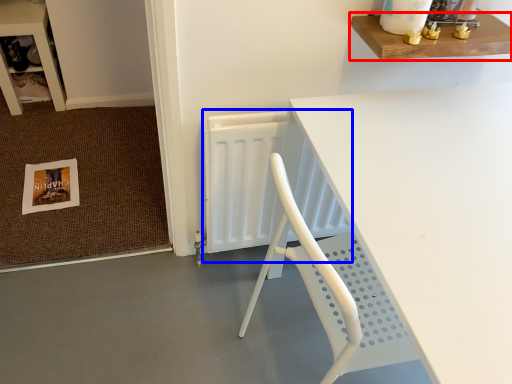
Question: Which point is closer to the camera, shelf (highlighted by a red box) or radiator (highlighted by a blue box)?

Choices:
 (A) shelf
 (B) radiator

Answer: (A)